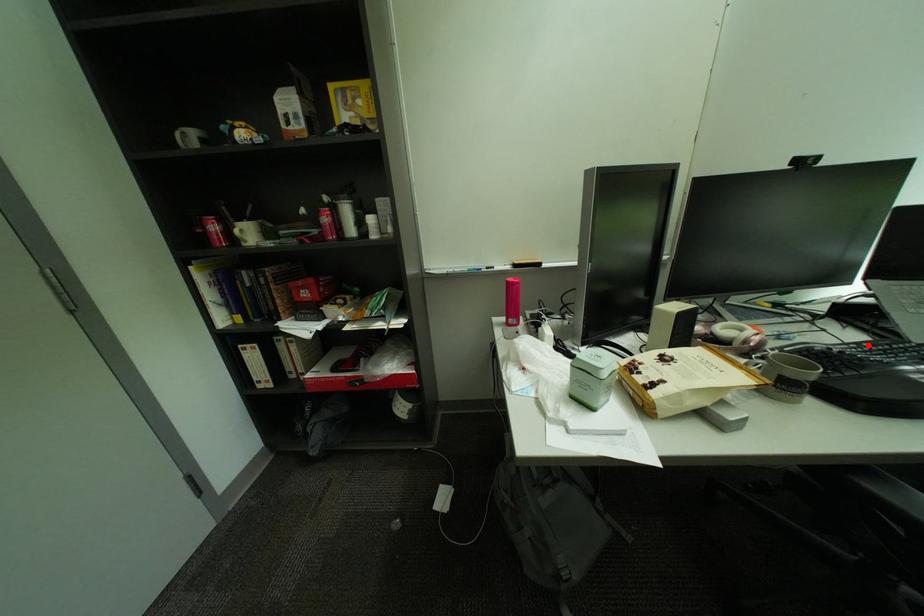
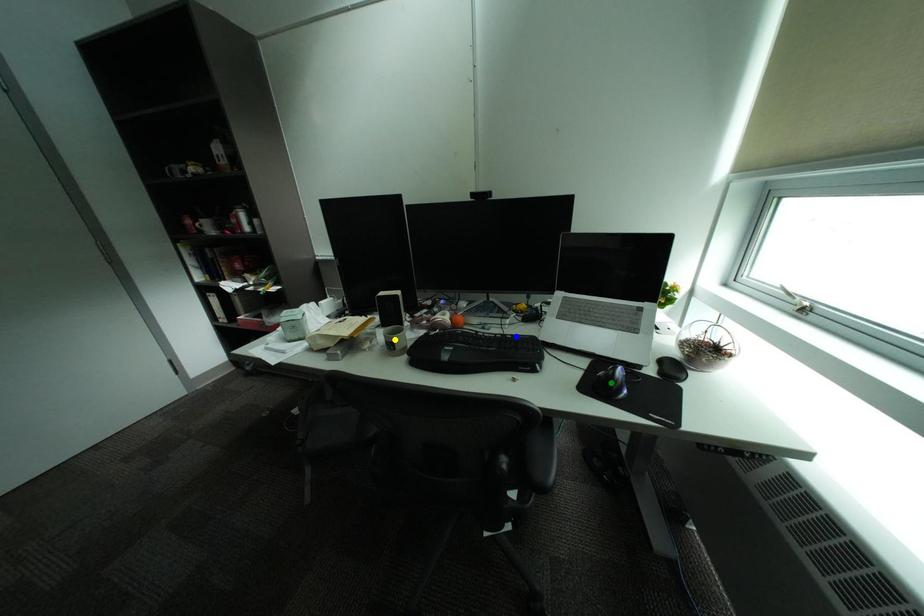
Question: I am providing you with two images of the same scene from different viewpoints. A red point is marked on the first image. You are given multiple points on the second image. In image 2, which mark is for the same physical point as the one in image 1?

Choices:
 (A) yellow point
 (B) blue point
 (C) green point

Answer: (B)